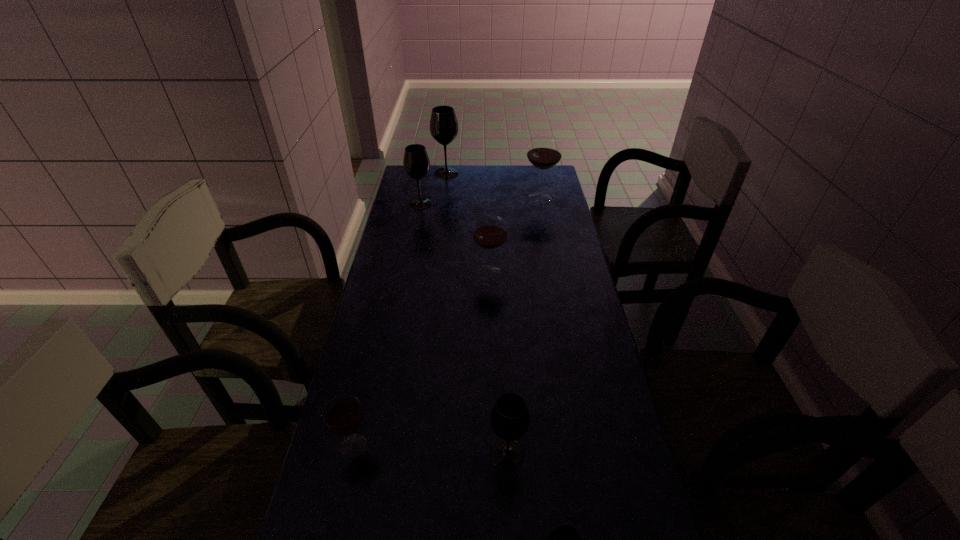
The image size is (960, 540). I want to click on the nearest red wineglass, so click(343, 414).

Locate an element on the screen. The height and width of the screenshot is (540, 960). vacant region located 0.090m on the left of the farthest object is located at coordinates (415, 173).

You are a GUI agent. You are given a task and a screenshot of the screen. Output one action in this format:
    pyautogui.click(x=<x>, y=<y>)
    Task: Click on the free space located 0.350m on the right of the second farthest gray wineglass
    The height and width of the screenshot is (540, 960).
    Given the screenshot: What is the action you would take?
    pyautogui.click(x=515, y=204)

In order to click on free space located on the left of the rightmost object in this screenshot , I will do coord(442,198).

Find the location of a particular element. vacant space situated on the front of the fourth farthest wineglass is located at coordinates click(x=491, y=306).

Image resolution: width=960 pixels, height=540 pixels. Identify the location of vacant space located 0.240m on the right of the third biggest gray wineglass. (626, 454).

This screenshot has height=540, width=960. Identify the location of free space located 0.340m on the right of the nearest red wineglass. (513, 446).

Find the location of a particular element. Image resolution: width=960 pixels, height=540 pixels. object present at the right edge is located at coordinates (544, 152).

Locate an element on the screen. Image resolution: width=960 pixels, height=540 pixels. object present at the far left corner is located at coordinates (443, 124).

This screenshot has height=540, width=960. I want to click on object that is at the far right corner, so click(544, 152).